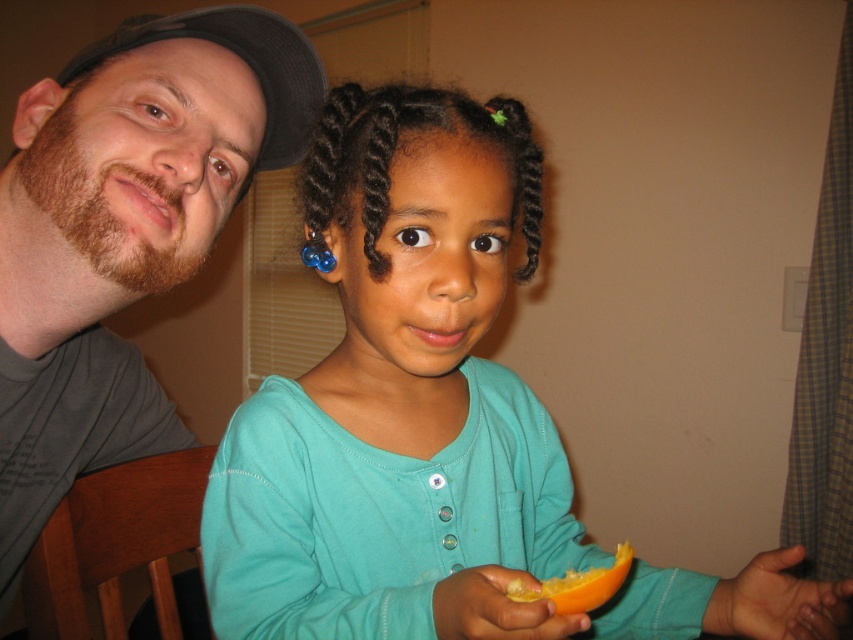
You are a photographer setting up for a portrait shoot. You notice the teal fabric shirt at center and the black fabric baseball cap at upper left in your frame. Which object should you adjust to ensure the shirt is visible without being blocked by the cap?

The black fabric baseball cap at upper left is above the teal fabric shirt at center, so adjusting the cap to move it out of the way would prevent it from blocking the shirt.